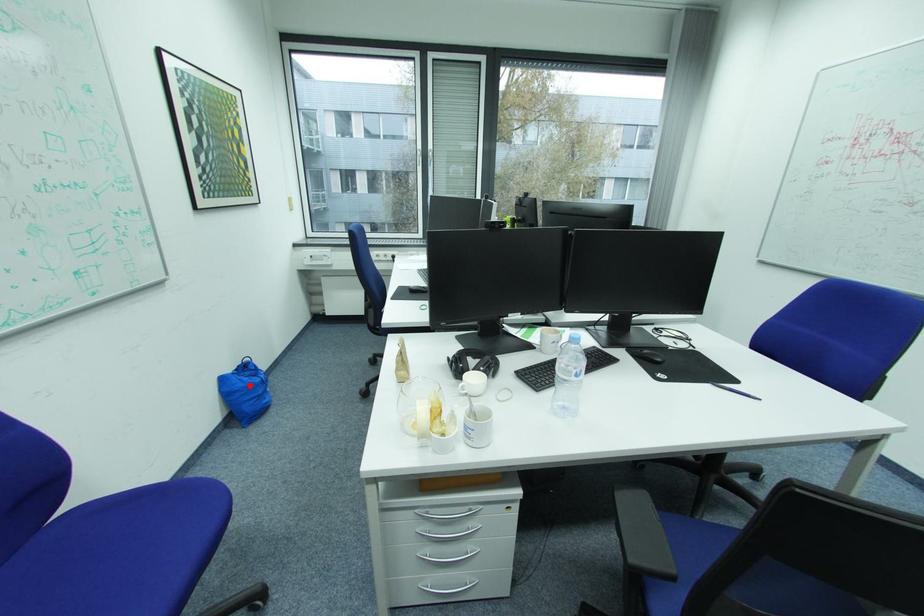
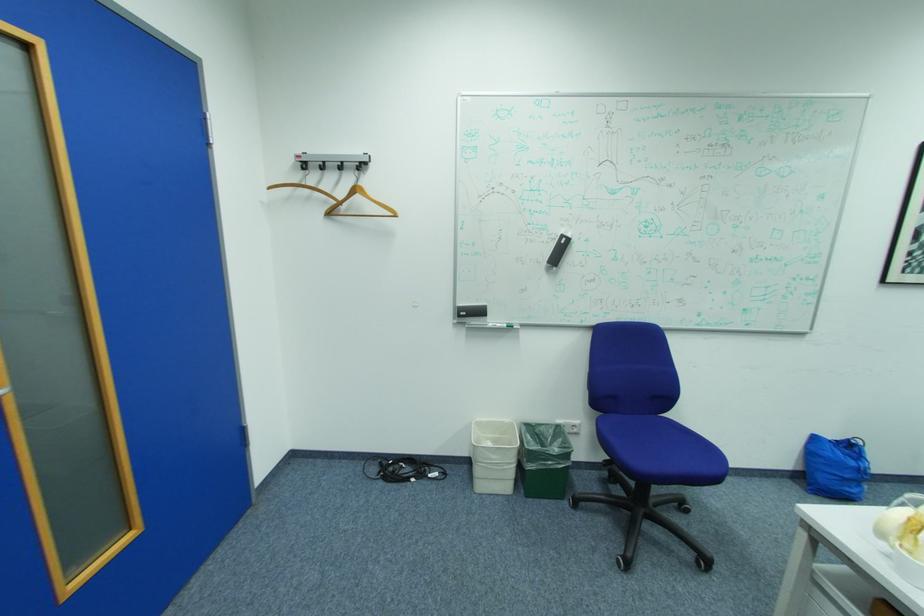
Question: I am providing you with two images of the same scene from different viewpoints. Image1 has a red point marked. In image2, the corresponding 3D location appears at what relative position? Reply with the corresponding letter.

Choices:
 (A) Closer
 (B) Farther

Answer: (B)